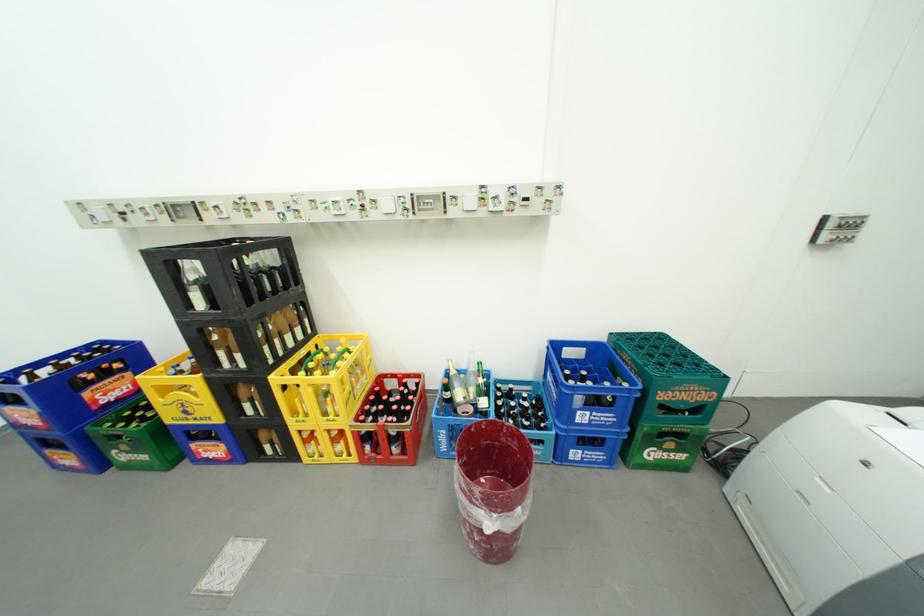
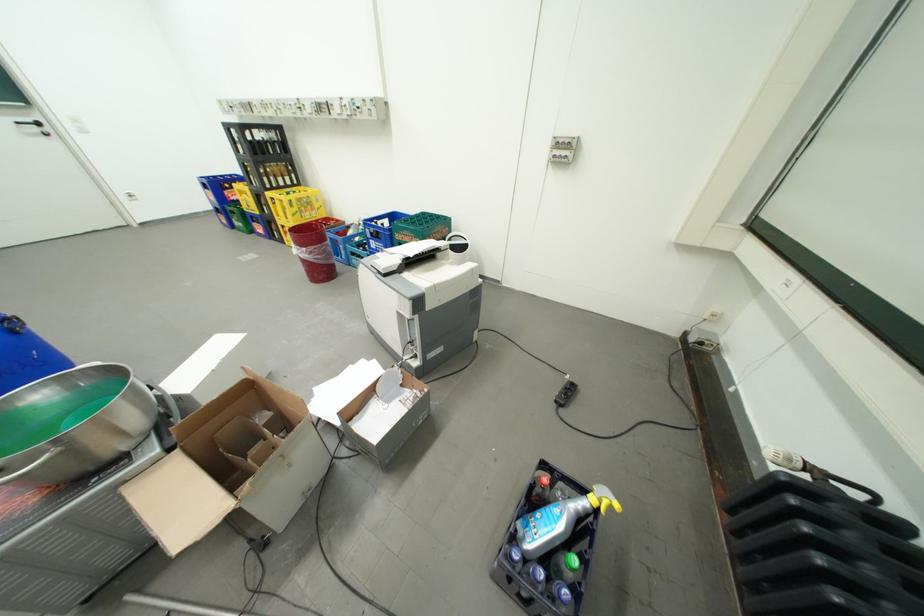
The point at [590,414] is marked in the first image. Where is the corresponding point in the second image?

(381, 241)